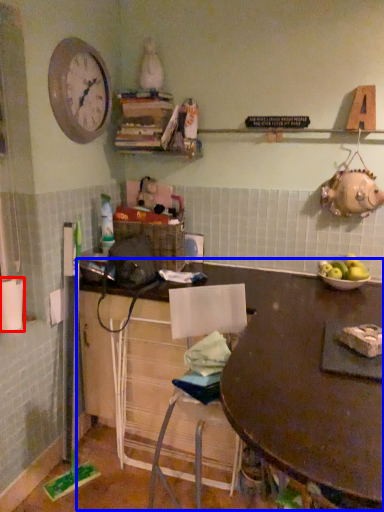
Question: Which object is closer to the camera taking this photo, toilet paper (highlighted by a red box) or table (highlighted by a blue box)?

Choices:
 (A) toilet paper
 (B) table

Answer: (B)